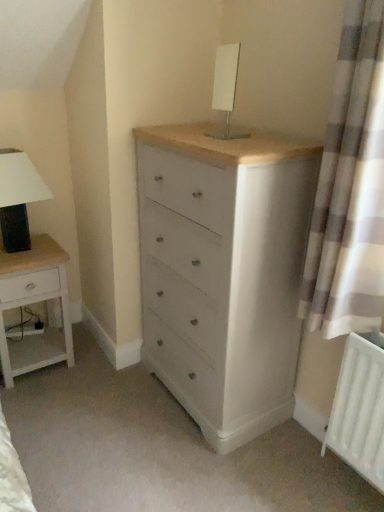
Question: From the image's perspective, does white glossy table lamp at upper center, the first table lamp in the front-to-back sequence, appear higher than matte black lampshade at left, which appears as the first table lamp when viewed from the left?

Choices:
 (A) yes
 (B) no

Answer: (A)

Question: Can matte black lampshade at left, which is the 2th table lamp from top to bottom, be found inside white glossy table lamp at upper center, the first table lamp in the front-to-back sequence?

Choices:
 (A) no
 (B) yes

Answer: (A)

Question: From a real-world perspective, is white glossy table lamp at upper center, arranged as the 2th table lamp when viewed from the back, positioned under matte black lampshade at left, which appears as the first table lamp when viewed from the left, based on gravity?

Choices:
 (A) yes
 (B) no

Answer: (B)

Question: Is white glossy table lamp at upper center, which is the 1th table lamp from top to bottom, to the left of matte black lampshade at left, which ranks as the 2th table lamp in right-to-left order, from the viewer's perspective?

Choices:
 (A) no
 (B) yes

Answer: (A)

Question: From a real-world perspective, is white glossy table lamp at upper center, which appears as the 2th table lamp when viewed from the left, on matte black lampshade at left, which is the 2th table lamp from top to bottom?

Choices:
 (A) no
 (B) yes

Answer: (B)

Question: In terms of width, does white checkered curtain at right look wider or thinner when compared to white glossy table lamp at upper center, which appears as the 2th table lamp when viewed from the left?

Choices:
 (A) wide
 (B) thin

Answer: (A)

Question: From the image's perspective, is white checkered curtain at right positioned above or below white glossy table lamp at upper center, which appears as the 2th table lamp when viewed from the left?

Choices:
 (A) below
 (B) above

Answer: (A)

Question: Which is correct: white checkered curtain at right is inside white glossy table lamp at upper center, which appears as the 1th table lamp when viewed from the right, or outside of it?

Choices:
 (A) inside
 (B) outside

Answer: (B)

Question: Does point (322, 159) appear closer or farther from the camera than point (228, 83)?

Choices:
 (A) closer
 (B) farther

Answer: (A)

Question: Is white checkered curtain at right in front of or behind white wood nightstand at left in the image?

Choices:
 (A) front
 (B) behind

Answer: (A)

Question: From a real-world perspective, is white checkered curtain at right positioned above or below white wood nightstand at left?

Choices:
 (A) below
 (B) above

Answer: (B)

Question: Considering the positions of white checkered curtain at right and white wood nightstand at left in the image, is white checkered curtain at right wider or thinner than white wood nightstand at left?

Choices:
 (A) wide
 (B) thin

Answer: (B)

Question: Considering the positions of white checkered curtain at right and white wood nightstand at left in the image, is white checkered curtain at right taller or shorter than white wood nightstand at left?

Choices:
 (A) tall
 (B) short

Answer: (A)

Question: Is matte black lampshade at left, marked as the 1th table lamp in a back-to-front arrangement, wider or thinner than white checkered curtain at right?

Choices:
 (A) wide
 (B) thin

Answer: (A)

Question: Relative to white checkered curtain at right, is matte black lampshade at left, which is the 1th table lamp from bottom to top, in front or behind?

Choices:
 (A) front
 (B) behind

Answer: (B)